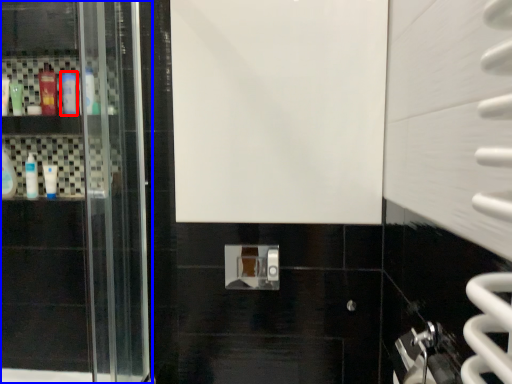
Question: Which of the following is the closest to the observer, mouthwash (highlighted by a red box) or door (highlighted by a blue box)?

Choices:
 (A) mouthwash
 (B) door

Answer: (B)